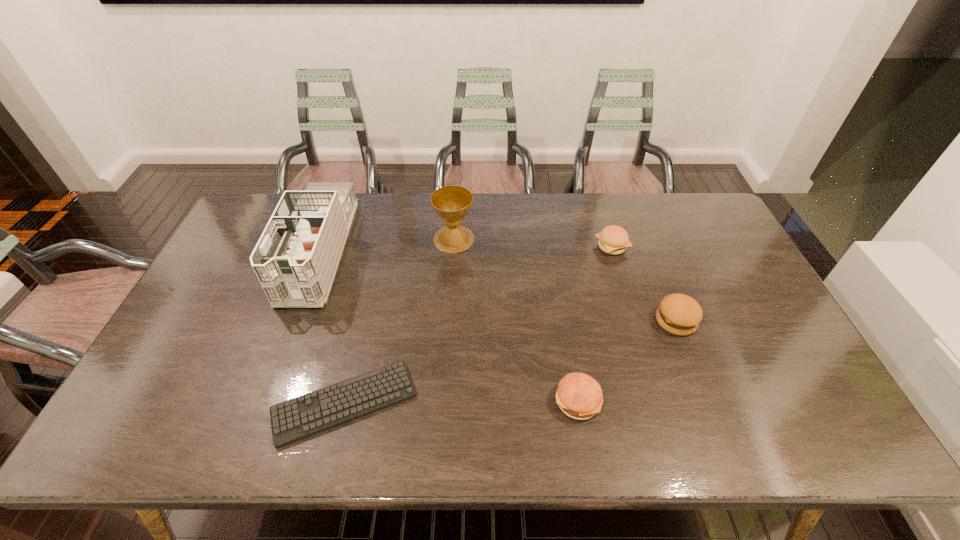
Locate an element on the screen. The height and width of the screenshot is (540, 960). free region at the near edge of the desktop is located at coordinates (399, 430).

In the image, there is a desktop. Where is `vacant space at the left edge`? The image size is (960, 540). vacant space at the left edge is located at coordinates (194, 368).

This screenshot has height=540, width=960. I want to click on vacant space at the far left corner of the desktop, so click(x=257, y=213).

Locate an element on the screen. vacant space at the far right corner of the desktop is located at coordinates pos(674,224).

Where is `vacant point located between the dollhouse and the nearest hamburger`? vacant point located between the dollhouse and the nearest hamburger is located at coordinates (448, 326).

Identify the location of empty space between the second shortest object and the shortest object. This screenshot has width=960, height=540. (461, 402).

Where is `free space between the chalice and the shortest object`? The height and width of the screenshot is (540, 960). free space between the chalice and the shortest object is located at coordinates (399, 321).

Where is `blank region between the shortest hamburger and the farthest hamburger`? blank region between the shortest hamburger and the farthest hamburger is located at coordinates (594, 324).

Identify the location of free space between the shortest object and the chalice. (399, 321).

The width and height of the screenshot is (960, 540). Find the location of `free space between the chalice and the second object from right to left`. free space between the chalice and the second object from right to left is located at coordinates (533, 243).